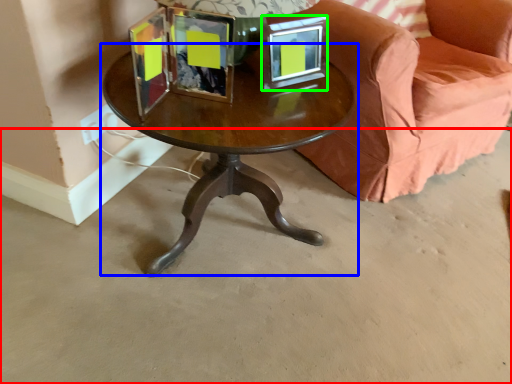
Question: Which is nearer to the concrete (highlighted by a red box)? coffee table (highlighted by a blue box) or picture frame (highlighted by a green box).

Choices:
 (A) coffee table
 (B) picture frame

Answer: (A)